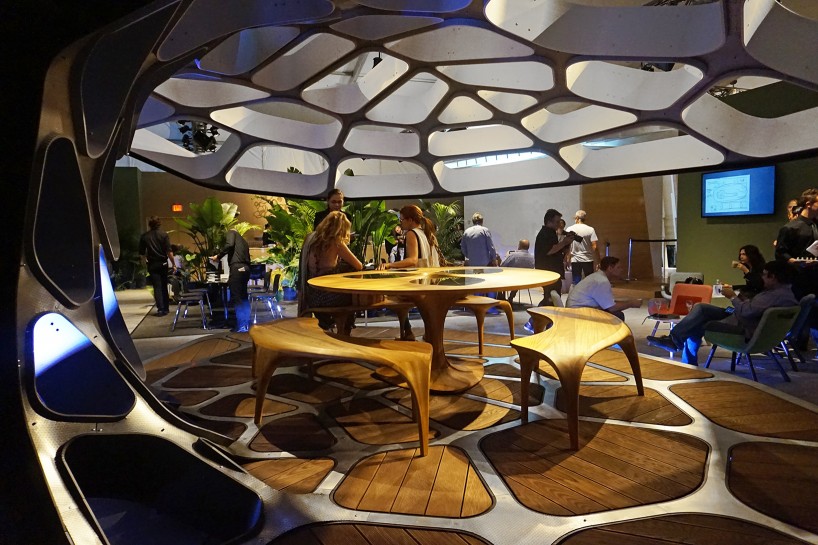
The height and width of the screenshot is (545, 818). Find the location of `tv screen on wall on right`. tv screen on wall on right is located at coordinates (721, 190), (758, 186).